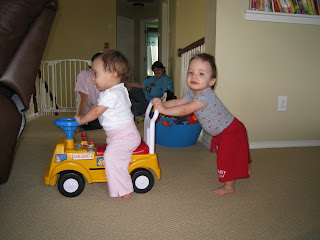
The image size is (320, 240). In order to click on electric outlet in this screenshot , I will do `click(280, 102)`.